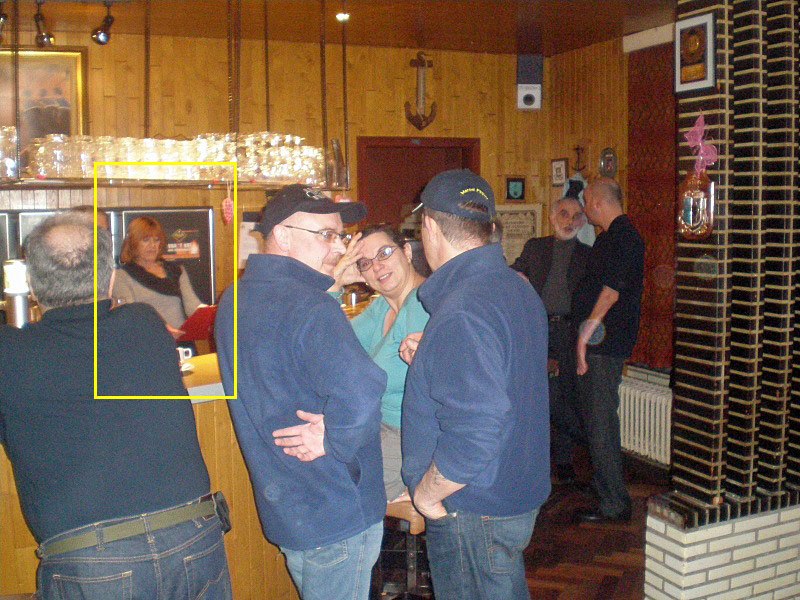
Where is `paneling`? paneling is located at coordinates (506, 151).